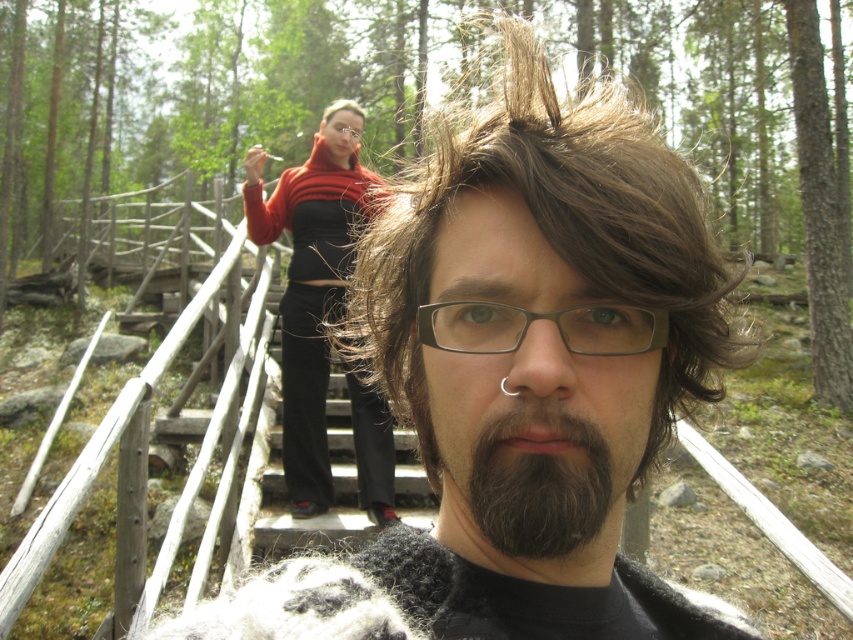
Does dark brown fuzzy beard at center have a lesser width compared to black plastic glasses at center?

Incorrect, dark brown fuzzy beard at center's width is not less than black plastic glasses at center's.

Does dark brown fuzzy beard at center have a greater width compared to black plastic glasses at center?

Correct, the width of dark brown fuzzy beard at center exceeds that of black plastic glasses at center.

Is point (543, 502) more distant than point (585, 337)?

No, (543, 502) is closer to viewer.

Locate an element on the screen. dark brown fuzzy beard at center is located at coordinates (535, 483).

Is brown wavy hair at center thinner than black plastic glasses at center?

No.

Who is positioned more to the right, brown wavy hair at center or black plastic glasses at center?

From the viewer's perspective, brown wavy hair at center appears more on the right side.

This screenshot has height=640, width=853. What are the coordinates of `brown wavy hair at center` in the screenshot? It's located at (556, 236).

Locate an element on the screen. The image size is (853, 640). brown wavy hair at center is located at coordinates (556, 236).

Can you confirm if orange sweater at center is taller than dark brown fuzzy beard at center?

Yes.

Is point (322, 474) farther from viewer compared to point (490, 512)?

That is True.

Find the location of a particular element. orange sweater at center is located at coordinates (311, 282).